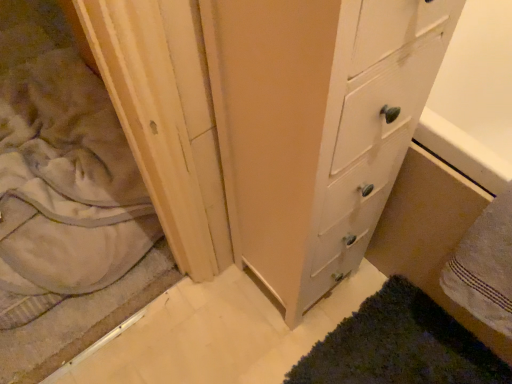
Question: In terms of size, does beige soft fabric at left appear bigger or smaller than dark green shaggy bath mat at lower right?

Choices:
 (A) big
 (B) small

Answer: (A)

Question: Is beige soft fabric at left in front of or behind dark green shaggy bath mat at lower right in the image?

Choices:
 (A) behind
 (B) front

Answer: (A)

Question: Which object is positioned closest to the white textured towel at lower right?

Choices:
 (A) white wood chest of drawers at center
 (B) dark green shaggy bath mat at lower right
 (C) beige soft fabric at left

Answer: (B)

Question: Estimate the real-world distances between objects in this image. Which object is farther from the white textured towel at lower right?

Choices:
 (A) white wood chest of drawers at center
 (B) dark green shaggy bath mat at lower right
 (C) beige soft fabric at left

Answer: (C)